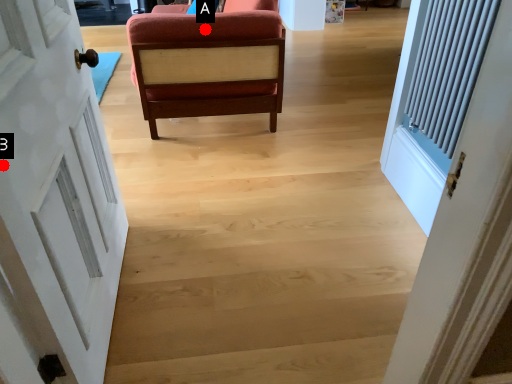
Question: Two points are circled on the image, labeled by A and B beside each circle. Which point is closer to the camera?

Choices:
 (A) A is closer
 (B) B is closer

Answer: (B)